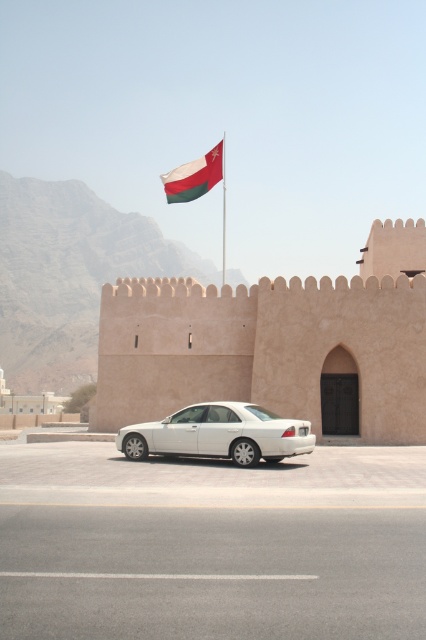
Question: Is matte beige wall at center thinner than white glossy sedan at center?

Choices:
 (A) no
 (B) yes

Answer: (A)

Question: Can you confirm if matte beige wall at center is positioned above olive green fabric flag at upper center?

Choices:
 (A) no
 (B) yes

Answer: (A)

Question: Where is olive green fabric flag at upper center located in relation to metallic flag pole at upper center in the image?

Choices:
 (A) above
 (B) below

Answer: (A)

Question: Which object is positioned farthest from the matte beige wall at center?

Choices:
 (A) white glossy sedan at center
 (B) metallic flag pole at upper center

Answer: (B)

Question: Which is nearer to the metallic flag pole at upper center?

Choices:
 (A) white glossy sedan at center
 (B) olive green fabric flag at upper center

Answer: (B)

Question: Which object is closer to the camera taking this photo?

Choices:
 (A) olive green fabric flag at upper center
 (B) white glossy sedan at center

Answer: (B)